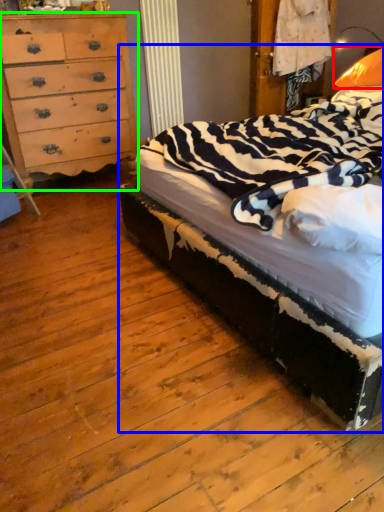
Question: Based on their relative distances, which object is farther from pillow (highlighted by a red box)? Choose from bed (highlighted by a blue box) and chest of drawers (highlighted by a green box).

Choices:
 (A) bed
 (B) chest of drawers

Answer: (B)